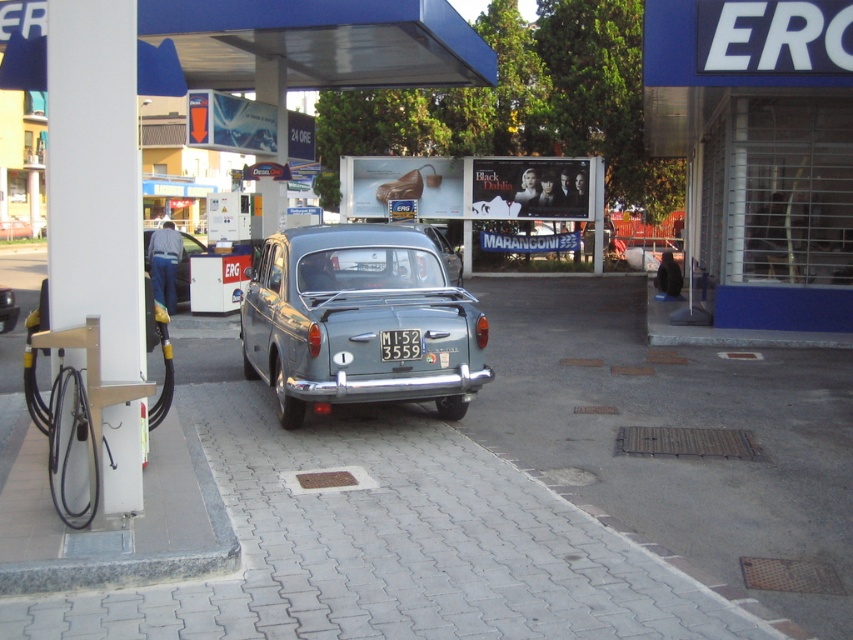
Image resolution: width=853 pixels, height=640 pixels. Describe the element at coordinates (186, 266) in the screenshot. I see `matte gray sedan at center` at that location.

Can you confirm if matte gray sedan at center is shorter than metallic gray sedan at center?

Yes.

This screenshot has height=640, width=853. Describe the element at coordinates (186, 266) in the screenshot. I see `matte gray sedan at center` at that location.

Where is `matte gray sedan at center`? Image resolution: width=853 pixels, height=640 pixels. matte gray sedan at center is located at coordinates (186, 266).

Measure the distance between point (258, 298) and camera.

8.62 meters

Between metallic gray car at center and matte gray sedan at center, which one appears on the right side from the viewer's perspective?

From the viewer's perspective, metallic gray car at center appears more on the right side.

Find the location of `metallic gray car at center`. metallic gray car at center is located at coordinates (358, 321).

Image resolution: width=853 pixels, height=640 pixels. I want to click on metallic gray car at center, so click(358, 321).

Is metallic gray sedan at center positioned behind shiny metallic car at center?

No, it is not.

Measure the distance between metallic gray sedan at center and camera.

The distance of metallic gray sedan at center from camera is 7.77 meters.

Where is `metallic gray sedan at center`? metallic gray sedan at center is located at coordinates (440, 250).